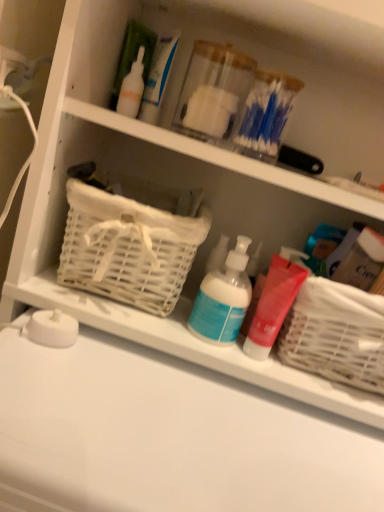
Question: Is point (362, 488) closer or farther from the camera than point (301, 309)?

Choices:
 (A) closer
 (B) farther

Answer: (A)

Question: From the image's perspective, is white matte counter top at lower center above or below white woven basket at right, arranged as the first basket when viewed from the right?

Choices:
 (A) above
 (B) below

Answer: (B)

Question: Which is nearer to the blue matte pump bottle at center, marked as the first cleaning product in a left-to-right arrangement?

Choices:
 (A) white wicker basket at left, which ranks as the first basket in left-to-right order
 (B) white matte counter top at lower center
 (C) matte red pump bottle at center, which ranks as the 1th cleaning product in right-to-left order
 (D) white woven basket at right, positioned as the 2th basket in left-to-right order

Answer: (C)

Question: Estimate the real-world distances between objects in this image. Which object is closer to the blue matte pump bottle at center, positioned as the second cleaning product in right-to-left order?

Choices:
 (A) white woven basket at right, positioned as the 2th basket in left-to-right order
 (B) matte red pump bottle at center, which is counted as the second cleaning product, starting from the left
 (C) white wicker basket at left, acting as the 2th basket starting from the right
 (D) white matte counter top at lower center

Answer: (B)